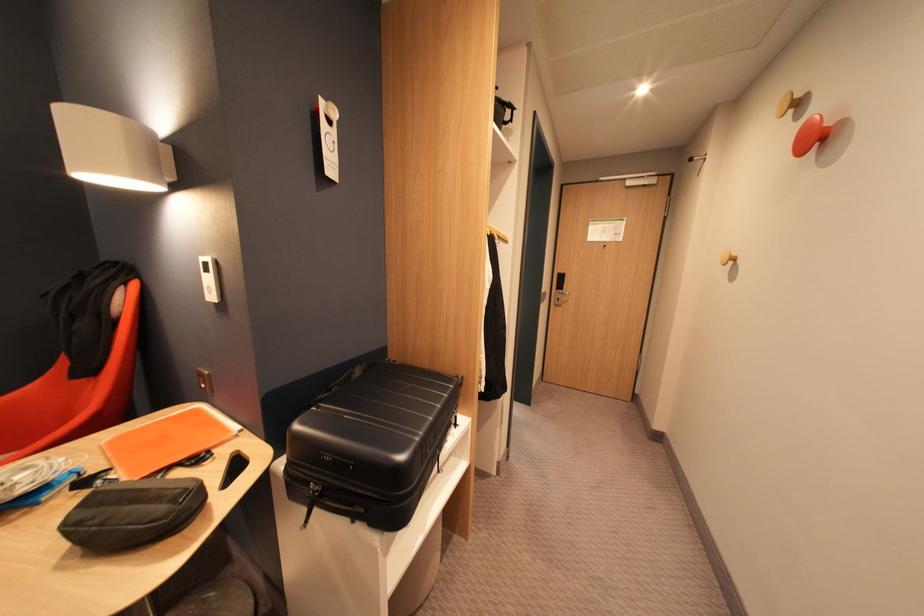
Where is `power outlet`? This screenshot has height=616, width=924. power outlet is located at coordinates (203, 381).